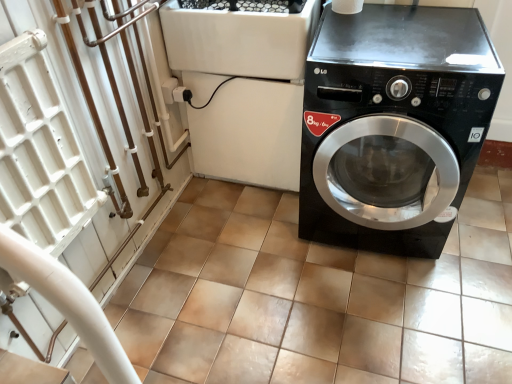
Question: Can you confirm if black plastic washing machine at center is bigger than brown tile at center?

Choices:
 (A) no
 (B) yes

Answer: (B)

Question: Can you confirm if black plastic washing machine at center is wider than brown tile at center?

Choices:
 (A) no
 (B) yes

Answer: (A)

Question: Is black plastic washing machine at center next to brown tile at center and touching it?

Choices:
 (A) no
 (B) yes

Answer: (A)

Question: From the image's perspective, is black plastic washing machine at center located above brown tile at center?

Choices:
 (A) yes
 (B) no

Answer: (A)

Question: Can you confirm if black plastic washing machine at center is positioned to the right of brown tile at center?

Choices:
 (A) yes
 (B) no

Answer: (B)

Question: Is black plastic washing machine at center positioned beyond the bounds of brown tile at center?

Choices:
 (A) yes
 (B) no

Answer: (A)

Question: From the image's perspective, is black plastic washing machine at center below black glossy washing machine at right?

Choices:
 (A) yes
 (B) no

Answer: (B)

Question: Is black plastic washing machine at center completely or partially outside of black glossy washing machine at right?

Choices:
 (A) no
 (B) yes

Answer: (B)

Question: Is black glossy washing machine at right a part of black plastic washing machine at center?

Choices:
 (A) yes
 (B) no

Answer: (B)

Question: Is black plastic washing machine at center oriented towards black glossy washing machine at right?

Choices:
 (A) no
 (B) yes

Answer: (A)

Question: Considering the relative sizes of black plastic washing machine at center and black glossy washing machine at right in the image provided, is black plastic washing machine at center shorter than black glossy washing machine at right?

Choices:
 (A) yes
 (B) no

Answer: (A)

Question: Does black plastic washing machine at center have a greater width compared to black glossy washing machine at right?

Choices:
 (A) yes
 (B) no

Answer: (B)

Question: Considering the relative sizes of black glossy washing machine at right and black plastic washing machine at center in the image provided, is black glossy washing machine at right bigger than black plastic washing machine at center?

Choices:
 (A) no
 (B) yes

Answer: (B)